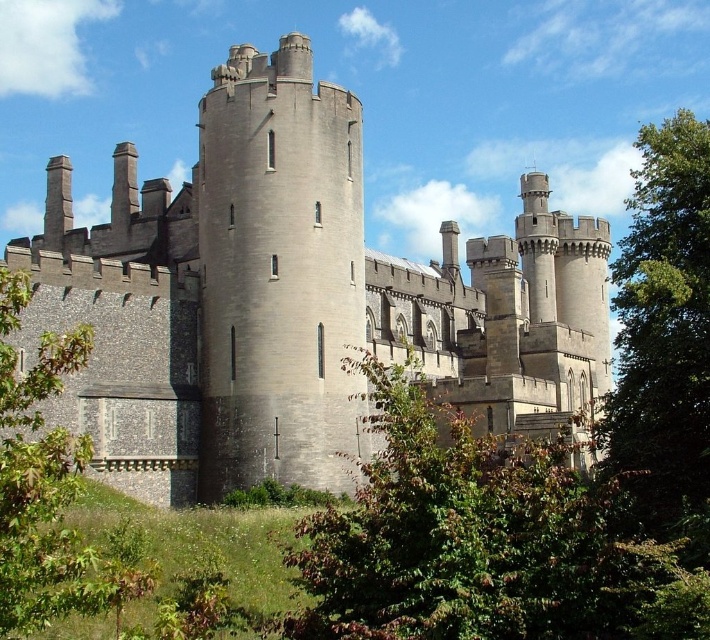
You are standing in front of the medieval castle and notice two points marked on the castle walls. The first point is at coordinate point (608, 401) and the second is at point (0, 388). Which point is closer to your viewpoint?

Point (0, 388) is closer to your viewpoint because it is nearer to the camera compared to point (608, 401), which is further away.